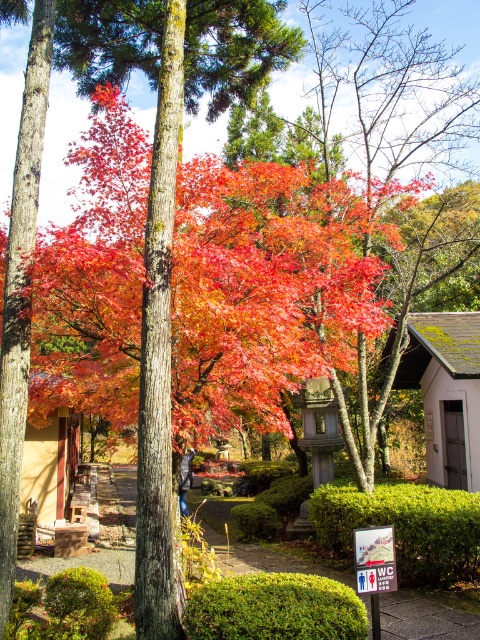
Which is below, green mossy wood hut at right or beige wooden hut at lower left?

Positioned lower is beige wooden hut at lower left.

Which of these two, green mossy wood hut at right or beige wooden hut at lower left, stands shorter?

green mossy wood hut at right

Measure the distance between green mossy wood hut at right and camera.

green mossy wood hut at right is 38.83 feet from camera.

You are a GUI agent. You are given a task and a screenshot of the screen. Output one action in this format:
    pyautogui.click(x=<x>, y=<y>)
    Task: Click on the green mossy wood hut at right
    Image resolution: width=480 pixels, height=640 pixels.
    Given the screenshot: What is the action you would take?
    pyautogui.click(x=445, y=392)

Is point (303, 573) closer to viewer compared to point (66, 445)?

Yes, it is.

Between green leafy bush at lower center and beige wooden hut at lower left, which one is positioned higher?

green leafy bush at lower center is above.

Describe the element at coordinates (275, 609) in the screenshot. I see `green leafy bush at lower center` at that location.

Locate an element on the screen. This screenshot has height=640, width=480. green leafy bush at lower center is located at coordinates (275, 609).

How far apart are green mossy wood hut at right and green leafy bush at lower center?

green mossy wood hut at right and green leafy bush at lower center are 25.30 feet apart from each other.

Between green mossy wood hut at right and green leafy bush at lower center, which one has less height?

green leafy bush at lower center

Where is `green mossy wood hut at right`? The height and width of the screenshot is (640, 480). green mossy wood hut at right is located at coordinates (445, 392).